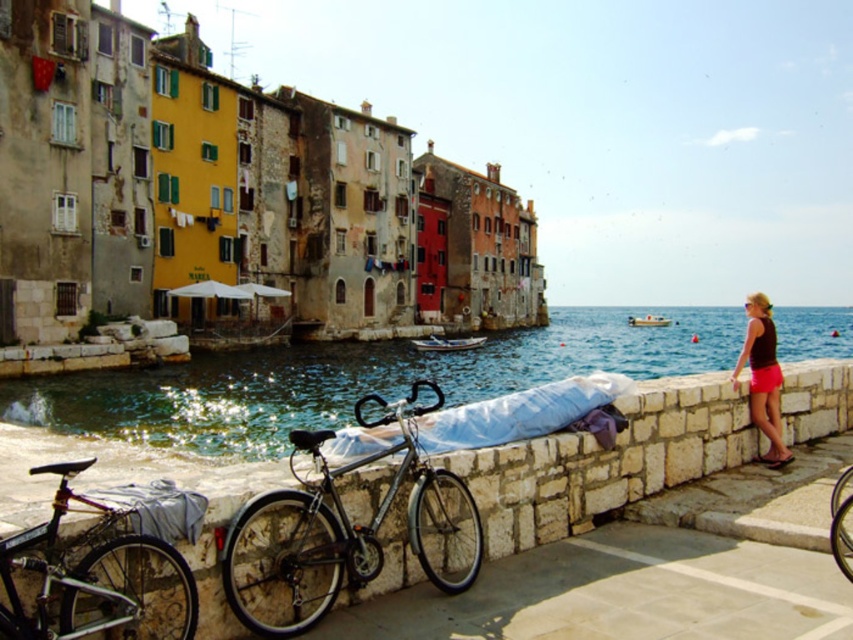
You are a tourist standing at the waterfront and want to take a photo of both shiny metallic bicycle at center and shiny metallic bicycle at lower right. Since they are both metallic, you need to ensure they are both fully visible in your photo. Which bicycle should you move closer to the camera to make sure both are visible without one blocking the other?

You should move the shiny metallic bicycle at lower right closer to the camera because the shiny metallic bicycle at center is currently in front of it, so moving the one at lower right forward would prevent it from being blocked.

You are standing at the point marked by the coordinates point (607,461). Looking around, you see the stone wall at lower center. Which direction should you walk to reach the waterfront?

The stone wall at lower center is located at point (607,461). Since the waterfront is in the background beyond the wall, you should walk forward towards the direction away from the wall to reach the waterfront.